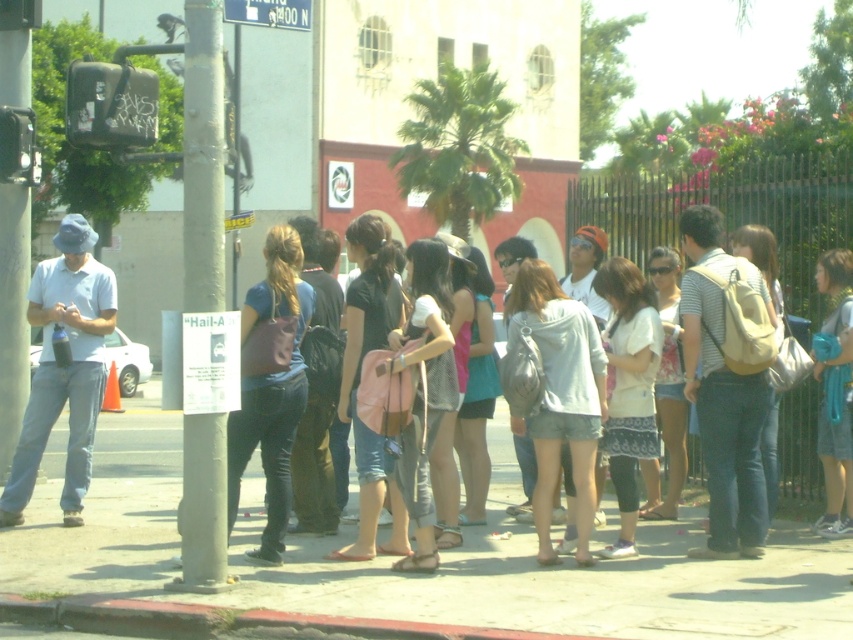
Question: Does red concrete curb at lower center appear under white plastic street sign at upper center?

Choices:
 (A) no
 (B) yes

Answer: (B)

Question: Estimate the real-world distances between objects in this image. Which object is closer to the white plastic street sign at upper center?

Choices:
 (A) matte pink backpack at center
 (B) red concrete curb at lower center
 (C) smooth concrete sidewalk at center

Answer: (A)

Question: Observing the image, what is the correct spatial positioning of smooth concrete sidewalk at center in reference to matte pink backpack at center?

Choices:
 (A) above
 (B) below

Answer: (B)

Question: Which object appears closest to the camera in this image?

Choices:
 (A) red concrete curb at lower center
 (B) matte pink backpack at center

Answer: (A)

Question: Can you confirm if smooth concrete sidewalk at center is thinner than matte pink backpack at center?

Choices:
 (A) yes
 (B) no

Answer: (B)

Question: Estimate the real-world distances between objects in this image. Which object is closer to the smooth concrete sidewalk at center?

Choices:
 (A) matte pink backpack at center
 (B) red concrete curb at lower center

Answer: (A)